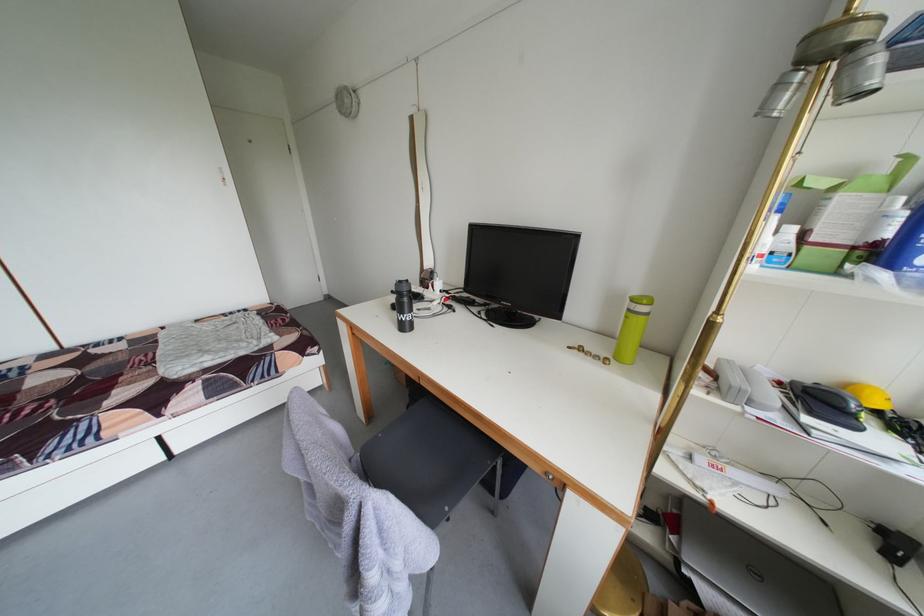
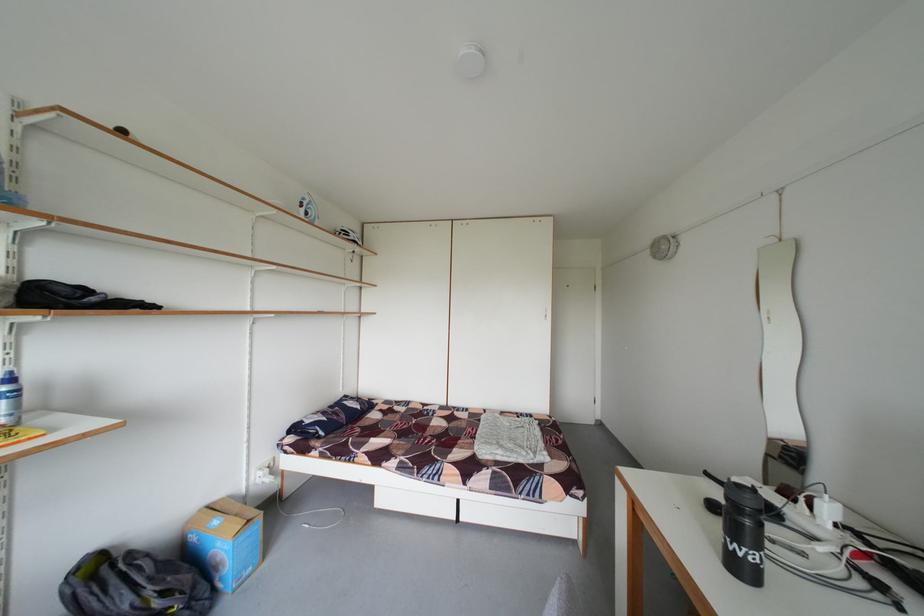
Question: The camera is either moving clockwise (left) or counter-clockwise (right) around the object. The first image is from the beginning of the video and the second image is from the end. Is the camera moving left or right when shooting the video?

Choices:
 (A) Left
 (B) Right

Answer: (B)